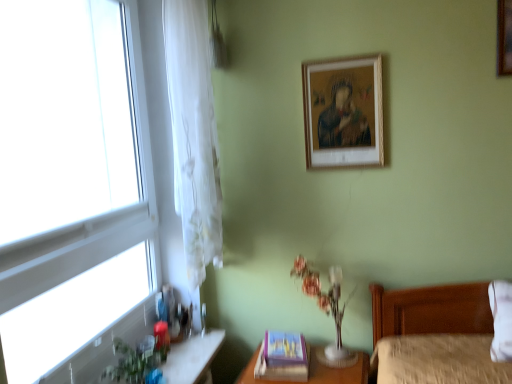
This screenshot has width=512, height=384. Identify the location of wooden picture frame at upper right, the first picture frame positioned from the right. (504, 37).

Describe the element at coordinates (192, 357) in the screenshot. I see `translucent glass vanity at lower left` at that location.

This screenshot has width=512, height=384. What are the coordinates of `white sheer curtain at left` in the screenshot? It's located at (193, 134).

Describe the element at coordinates (326, 309) in the screenshot. I see `translucent glass vase at center` at that location.

This screenshot has width=512, height=384. I want to click on wooden table at lower right, so click(315, 372).

Image resolution: width=512 pixels, height=384 pixels. Describe the element at coordinates (284, 348) in the screenshot. I see `purple cardboard picture frame at lower center, which is the third picture frame in top-to-bottom order` at that location.

Describe the element at coordinates (343, 112) in the screenshot. The width and height of the screenshot is (512, 384). I see `wooden picture frame at upper center, which is counted as the 2th picture frame, starting from the right` at that location.

This screenshot has height=384, width=512. Identify the location of wooden picture frame at upper right, which is the 1th picture frame from top to bottom. (504, 37).

Which of these two, wooden picture frame at upper center, which is counted as the 2th picture frame, starting from the right, or transparent glass window at left, stands shorter?

wooden picture frame at upper center, which is counted as the 2th picture frame, starting from the right, is shorter.

Is there a large distance between wooden picture frame at upper center, which is counted as the 2th picture frame, starting from the right, and transparent glass window at left?

Yes, wooden picture frame at upper center, which is counted as the 2th picture frame, starting from the right, and transparent glass window at left are quite far apart.

In the image, is wooden picture frame at upper center, the second picture frame positioned from the bottom, positioned in front of or behind transparent glass window at left?

wooden picture frame at upper center, the second picture frame positioned from the bottom, is positioned farther from the viewer than transparent glass window at left.

Based on the photo, is wooden picture frame at upper center, which is counted as the 2th picture frame, starting from the top, surrounding transparent glass window at left?

No, transparent glass window at left is not inside wooden picture frame at upper center, which is counted as the 2th picture frame, starting from the top.

How distant is translucent glass vanity at lower left from transparent glass window at left?

A distance of 33.58 inches exists between translucent glass vanity at lower left and transparent glass window at left.

Between translucent glass vanity at lower left and transparent glass window at left, which one has larger width?

translucent glass vanity at lower left is wider.

Which is less distant, (213,354) or (40,365)?

Point (213,354) is positioned closer to the camera compared to point (40,365).

From a real-world perspective, relative to transparent glass window at left, is translucent glass vanity at lower left vertically above or below?

From a real-world perspective, translucent glass vanity at lower left is physically below transparent glass window at left.

Is translucent glass vase at center positioned with its back to white sheer curtain at left?

No, translucent glass vase at center's orientation is not away from white sheer curtain at left.

Is translucent glass vase at center closer to the viewer compared to white sheer curtain at left?

No, the depth of translucent glass vase at center is greater than that of white sheer curtain at left.

From a real-world perspective, is translucent glass vase at center above or below white sheer curtain at left?

In terms of real-world spatial position, translucent glass vase at center is below white sheer curtain at left.

How much distance is there between translucent glass vase at center and white sheer curtain at left?

translucent glass vase at center and white sheer curtain at left are 29.77 inches apart from each other.

Is translucent glass vanity at lower left at the right side of wooden table at lower right?

Incorrect, translucent glass vanity at lower left is not on the right side of wooden table at lower right.

Can you confirm if translucent glass vanity at lower left is thinner than wooden table at lower right?

Indeed, translucent glass vanity at lower left has a lesser width compared to wooden table at lower right.

How far apart are translucent glass vanity at lower left and wooden table at lower right?

translucent glass vanity at lower left is 14.50 inches away from wooden table at lower right.

Who is smaller, translucent glass vanity at lower left or wooden table at lower right?

Smaller between the two is translucent glass vanity at lower left.

Would you say wooden picture frame at upper right, which is the 1th picture frame from top to bottom, is part of white sheer curtain at left's contents?

No, wooden picture frame at upper right, which is the 1th picture frame from top to bottom, is not a part of white sheer curtain at left.

How far apart are white sheer curtain at left and wooden picture frame at upper right, acting as the third picture frame starting from the bottom?

white sheer curtain at left is 1.33 meters away from wooden picture frame at upper right, acting as the third picture frame starting from the bottom.

Is white sheer curtain at left in front of or behind wooden picture frame at upper right, the first picture frame positioned from the right, in the image?

white sheer curtain at left is in front of wooden picture frame at upper right, the first picture frame positioned from the right.

How different are the orientations of white sheer curtain at left and wooden picture frame at upper right, acting as the third picture frame starting from the bottom, in degrees?

The facing directions of white sheer curtain at left and wooden picture frame at upper right, acting as the third picture frame starting from the bottom, are 89.8 degrees apart.

Can you confirm if wooden picture frame at upper right, which is the 1th picture frame from top to bottom, is taller than translucent glass vase at center?

Incorrect, the height of wooden picture frame at upper right, which is the 1th picture frame from top to bottom, is not larger of that of translucent glass vase at center.

Is wooden picture frame at upper right, acting as the third picture frame starting from the bottom, aimed at translucent glass vase at center?

No.

Is wooden picture frame at upper right, the first picture frame positioned from the right, closer to camera compared to translucent glass vase at center?

That is True.

Is wooden picture frame at upper right, the first picture frame positioned from the right, bigger or smaller than translucent glass vase at center?

Considering their sizes, wooden picture frame at upper right, the first picture frame positioned from the right, takes up less space than translucent glass vase at center.

Is translucent glass vase at center directly adjacent to wooden picture frame at upper right, acting as the third picture frame starting from the bottom?

No, translucent glass vase at center is not with wooden picture frame at upper right, acting as the third picture frame starting from the bottom.

Is translucent glass vase at center located outside wooden picture frame at upper right, the first picture frame positioned from the right?

translucent glass vase at center lies outside wooden picture frame at upper right, the first picture frame positioned from the right,'s area.

Which is more to the left, translucent glass vase at center or wooden picture frame at upper right, acting as the third picture frame starting from the bottom?

From the viewer's perspective, translucent glass vase at center appears more on the left side.

Find the location of a particular element. window on the left of wooden picture frame at upper center, which is counted as the 2th picture frame, starting from the top is located at coordinates (74, 182).

Find the location of a particular element. The height and width of the screenshot is (384, 512). vanity beneath the transparent glass window at left (from a real-world perspective) is located at coordinates (192, 357).

Which object lies further to the anchor point white sheer curtain at left, wooden table at lower right or translucent glass vase at center?

wooden table at lower right is positioned further to the anchor white sheer curtain at left.

When comparing their distances from wooden picture frame at upper right, acting as the third picture frame starting from the bottom, does translucent glass vanity at lower left or purple cardboard picture frame at lower center, which is the third picture frame in top-to-bottom order, seem closer?

Among the two, purple cardboard picture frame at lower center, which is the third picture frame in top-to-bottom order, is located nearer to wooden picture frame at upper right, acting as the third picture frame starting from the bottom.

Looking at this image, based on their spatial positions, is white sheer curtain at left or transparent glass window at left closer to translucent glass vase at center?

white sheer curtain at left.

Looking at the image, which one is located further to wooden picture frame at upper center, which is counted as the 2th picture frame, starting from the right, purple cardboard picture frame at lower center, which is the third picture frame in top-to-bottom order, or transparent glass window at left?

transparent glass window at left is positioned further to the anchor wooden picture frame at upper center, which is counted as the 2th picture frame, starting from the right.

Which object lies further to the anchor point white sheer curtain at left, translucent glass vase at center or purple cardboard picture frame at lower center, the 1th picture frame in the left-to-right sequence?

The object further to white sheer curtain at left is purple cardboard picture frame at lower center, the 1th picture frame in the left-to-right sequence.

Based on their spatial positions, is wooden table at lower right or purple cardboard picture frame at lower center, the 1th picture frame in the left-to-right sequence, closer to translucent glass vase at center?

wooden table at lower right lies closer to translucent glass vase at center than the other object.

When comparing their distances from wooden table at lower right, does wooden picture frame at upper right, the first picture frame positioned from the right, or wooden picture frame at upper center, which is counted as the 2th picture frame, starting from the top, seem further?

wooden picture frame at upper right, the first picture frame positioned from the right, lies further to wooden table at lower right than the other object.

Considering their positions, is wooden table at lower right positioned closer to transparent glass window at left than wooden picture frame at upper center, marked as the 2th picture frame in a left-to-right arrangement?

wooden picture frame at upper center, marked as the 2th picture frame in a left-to-right arrangement.

The height and width of the screenshot is (384, 512). In order to click on picture frame between translucent glass vanity at lower left and translucent glass vase at center in the horizontal direction in this screenshot , I will do `click(284, 348)`.

At what (x,y) coordinates should I click in order to perform the action: click on floral arrangement situated between transparent glass window at left and wooden picture frame at upper right, acting as the third picture frame starting from the bottom, from left to right. Please return your answer as a coordinate pair (x, y). The image size is (512, 384). Looking at the image, I should click on (326, 309).

The width and height of the screenshot is (512, 384). What are the coordinates of `floral arrangement between wooden picture frame at upper center, the second picture frame positioned from the bottom, and wooden table at lower right in the up-down direction` in the screenshot? It's located at (326, 309).

Identify the location of floral arrangement between wooden picture frame at upper right, the first picture frame positioned from the right, and translucent glass vanity at lower left vertically. (326, 309).